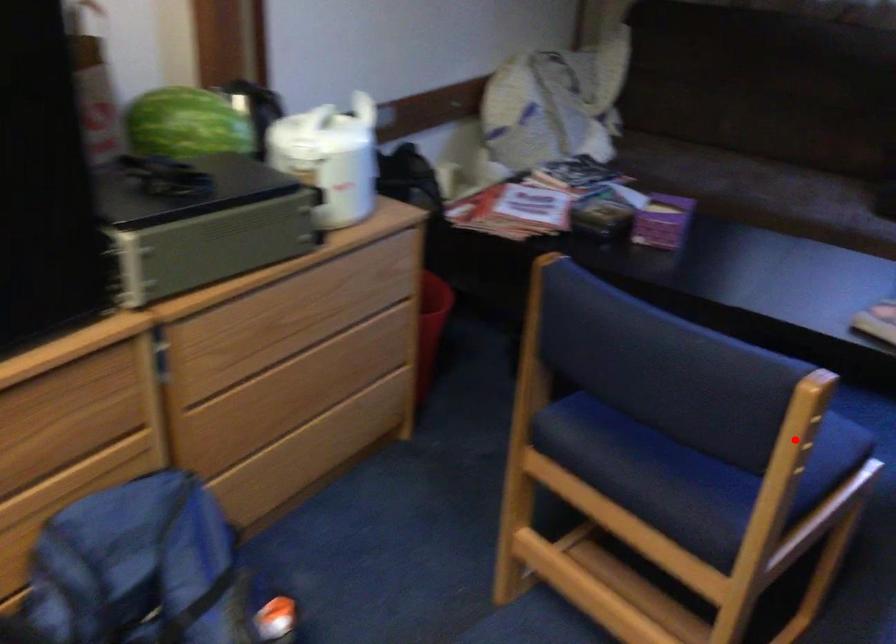
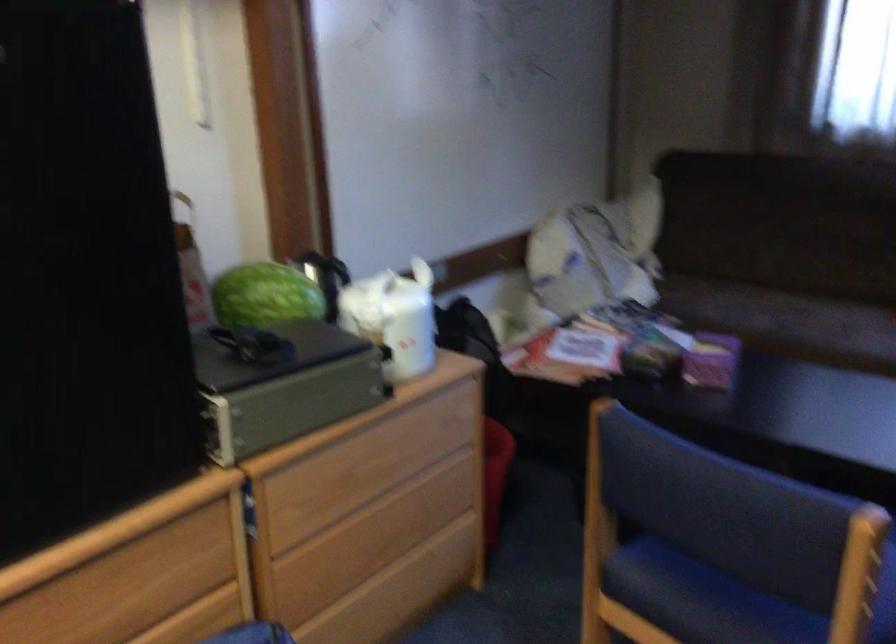
Question: I am providing you with two images of the same scene from different viewpoints. A red point is marked on the first image. Is the red point's position out of view in image 2?

Choices:
 (A) Yes
 (B) No

Answer: (B)